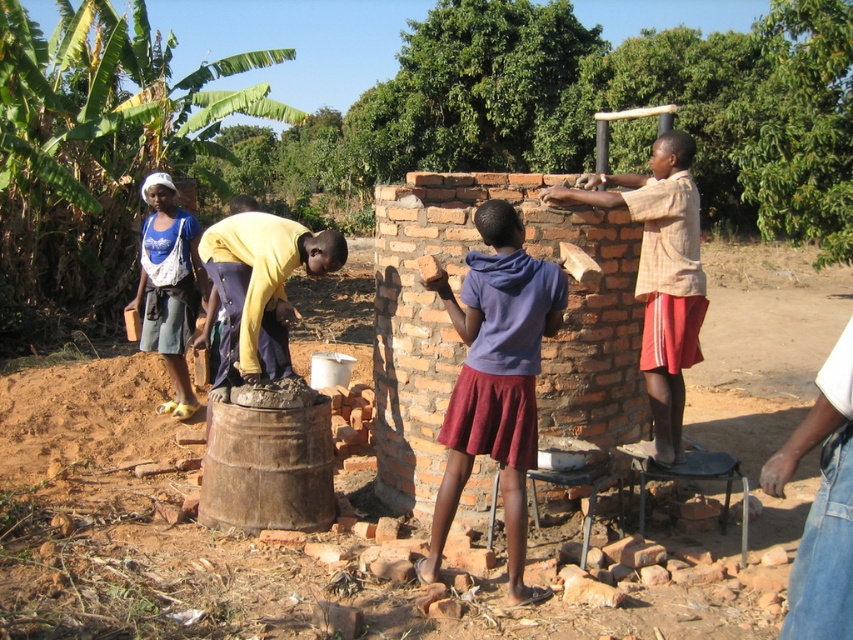
Question: Which point is farther to the camera?

Choices:
 (A) (183, 278)
 (B) (476, 285)
 (C) (256, 358)
 (D) (845, 422)

Answer: (A)

Question: Does yellow fabric shirt at center appear on the right side of denim shorts at left?

Choices:
 (A) yes
 (B) no

Answer: (A)

Question: Is denim jeans at lower right above denim shorts at left?

Choices:
 (A) yes
 (B) no

Answer: (B)

Question: Which point is farther to the camera?

Choices:
 (A) yellow fabric shirt at center
 (B) purple matte skirt at center

Answer: (A)

Question: Which object is farther from the camera taking this photo?

Choices:
 (A) purple matte skirt at center
 (B) yellow fabric shirt at center
 (C) denim jeans at lower right
 (D) denim shorts at left

Answer: (D)

Question: Does yellow fabric shirt at center have a greater width compared to denim shorts at left?

Choices:
 (A) yes
 (B) no

Answer: (A)